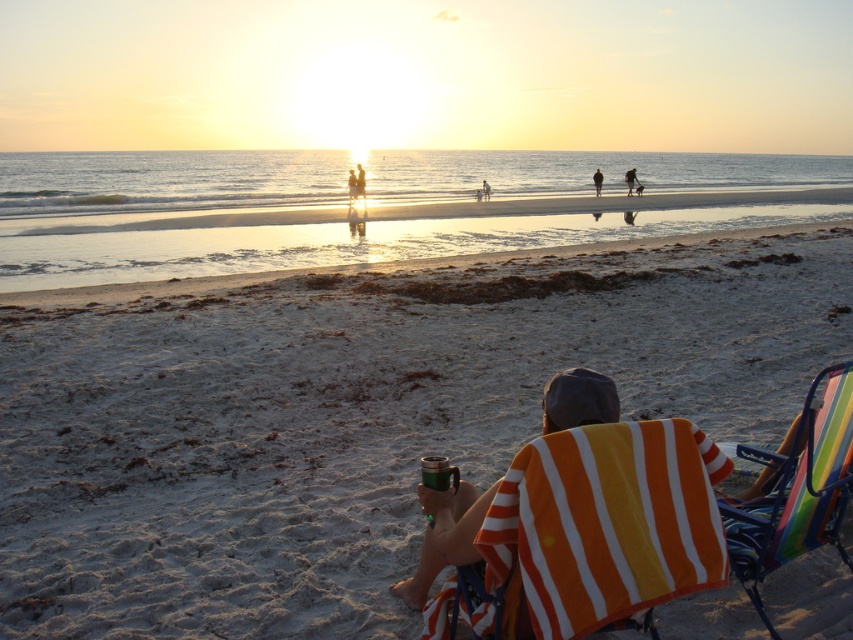
You are standing on the white sandy beach at center and want to reach the dark brown leather jacket at upper center. Which direction should you move to get closer to the jacket?

You should move towards the upper direction because the white sandy beach at center is in front of the dark brown leather jacket at upper center, meaning the jacket is located above the beach in the image.

You are standing at the point marked as point [352,416] in the image. What is the type of terrain you are currently standing on?

The terrain at point [352,416] is white sandy beach at center.

You are standing on the beach and see the smooth skin person at center and the orange striped towel at lower right. Which object is located to the right of the other?

The orange striped towel at lower right is positioned on the right side of smooth skin person at center.